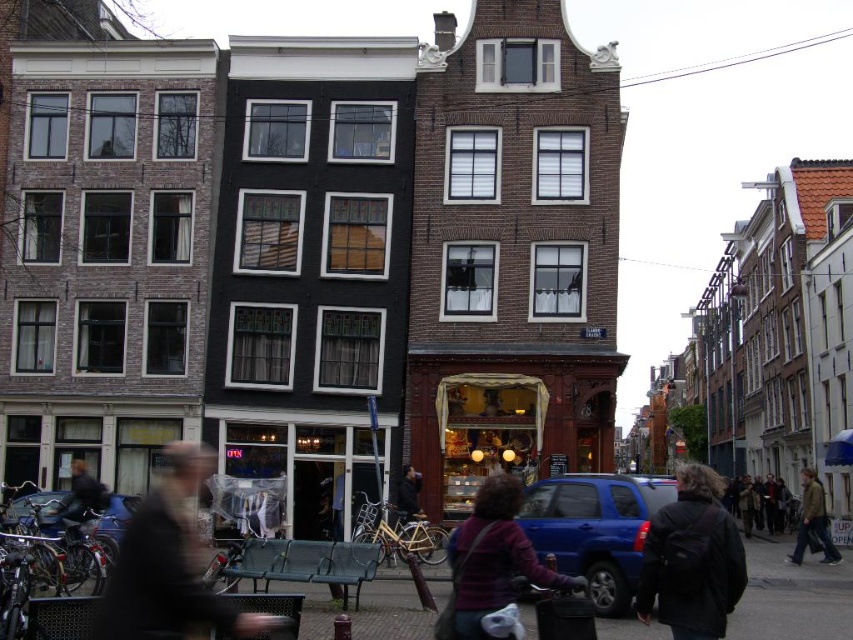
You are standing at the point with coordinates point (804, 474) and want to walk to the point with coordinates point (668, 611). Which direction should you move relative to the other point?

You should move forward because point (668, 611) is in front of point (804, 474).